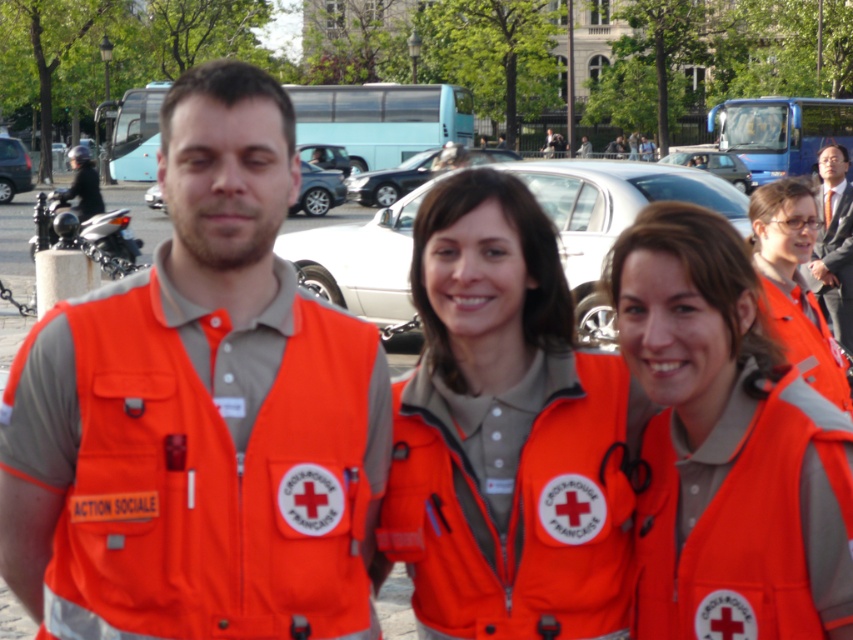
Question: Which of these objects is positioned closest to the smooth suit at upper right?

Choices:
 (A) orange fabric vest at center
 (B) orange fabric vest at left
 (C) matte orange vest at center
 (D) orange softshell jacket at center

Answer: (A)

Question: Is the position of orange softshell jacket at center more distant than that of matte orange vest at center?

Choices:
 (A) no
 (B) yes

Answer: (B)

Question: Which object is farther from the camera taking this photo?

Choices:
 (A) orange softshell jacket at center
 (B) orange fabric vest at center

Answer: (B)

Question: Which object is farther from the camera taking this photo?

Choices:
 (A) orange softshell jacket at center
 (B) smooth suit at upper right
 (C) orange fabric vest at center

Answer: (B)

Question: Is orange fabric vest at center positioned in front of smooth suit at upper right?

Choices:
 (A) yes
 (B) no

Answer: (A)

Question: Does orange softshell jacket at center appear under matte orange vest at center?

Choices:
 (A) yes
 (B) no

Answer: (B)